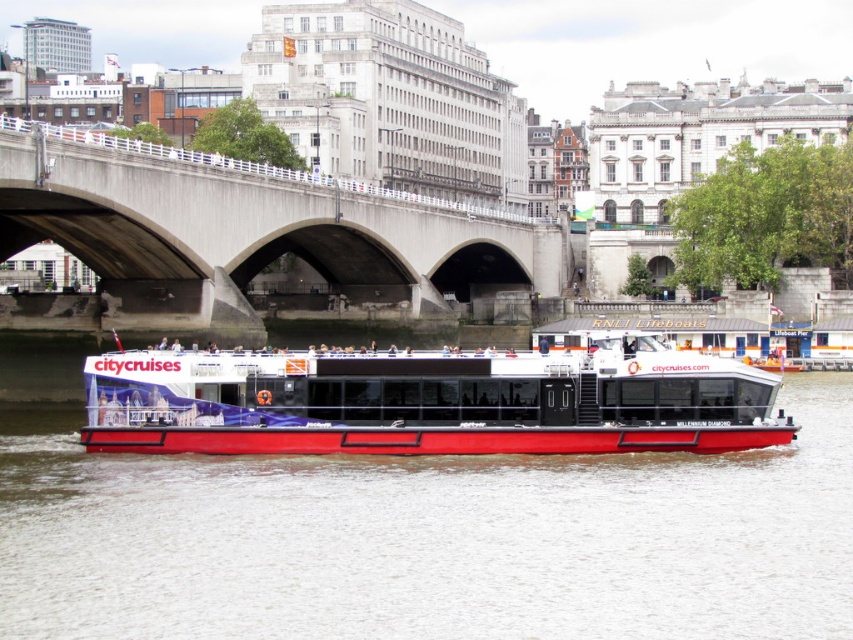
You are a photographer standing on the Millennium Diamond cruise boat. You want to take a photo that includes both the red matte water at center and the concrete bridge at center. Based on their positions, which object should you position closer to the left side of your camera frame?

The concrete bridge at center should be positioned closer to the left side of the camera frame because the red matte water at center is to the right of the concrete bridge at center.